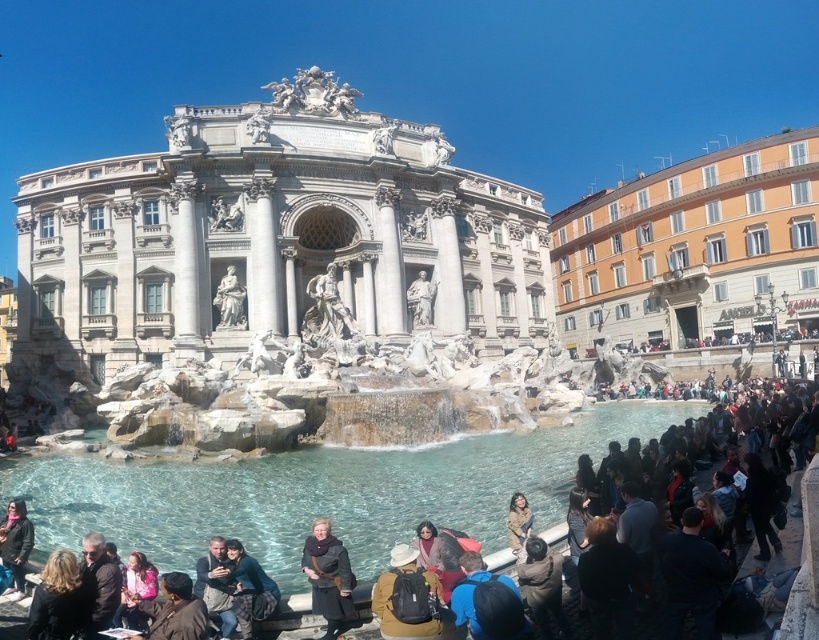
Question: Estimate the real-world distances between objects in this image. Which object is closer to the brown leather jacket at lower center?

Choices:
 (A) dark gray knit hat at lower left
 (B) dark brown leather jacket at lower center

Answer: (B)

Question: Which point is farther to the camera?

Choices:
 (A) (265, 598)
 (B) (526, 515)
 (C) (340, 596)
 (D) (125, 625)

Answer: (B)

Question: From the image, what is the correct spatial relationship of dark gray knit hat at lower left in relation to brown leather jacket at lower center?

Choices:
 (A) left
 (B) right

Answer: (A)

Question: Can you confirm if dark brown leather coat at lower center is positioned to the left of dark gray knit hat at lower left?

Choices:
 (A) no
 (B) yes

Answer: (A)

Question: Estimate the real-world distances between objects in this image. Which object is farther from the brown leather jacket at lower center?

Choices:
 (A) dark gray knit hat at lower left
 (B) dark brown leather jacket at lower left
 (C) dark blue fabric jacket at lower center
 (D) dark brown leather jacket at lower center

Answer: (A)

Question: Observing the image, what is the correct spatial positioning of dark brown leather jacket at lower center in reference to dark brown leather coat at lower center?

Choices:
 (A) above
 (B) below

Answer: (A)